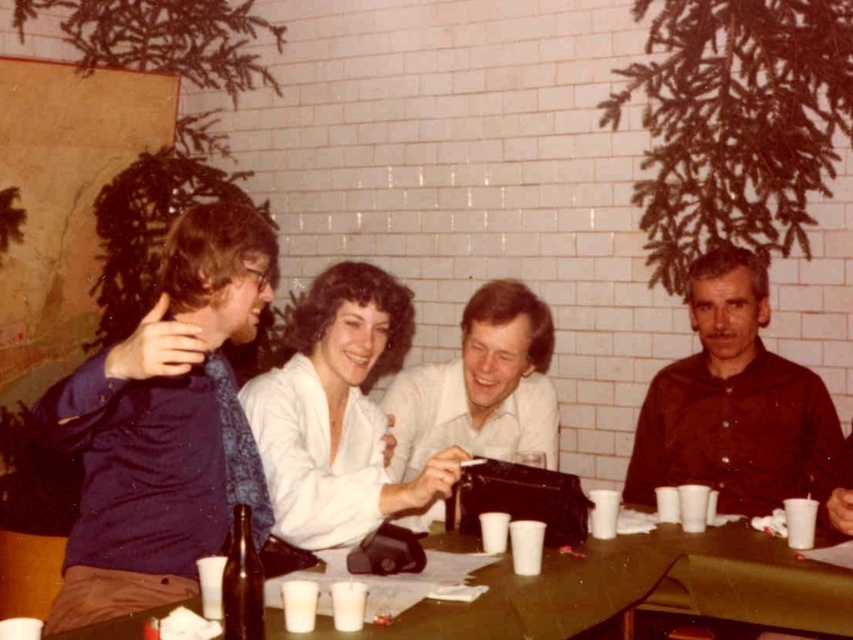
You are a photographer trying to capture a candid shot of the two people wearing the blue satin shirt at left and dark brown shirt at right. The camera you are using has a maximum focus range of 5 feet. Can you fit both subjects into the frame without moving the camera?

The blue satin shirt at left and dark brown shirt at right are 5.15 feet apart from each other, which exceeds the camera maximum focus range of 5 feet. Therefore, you cannot fit both subjects into the frame without moving the camera.